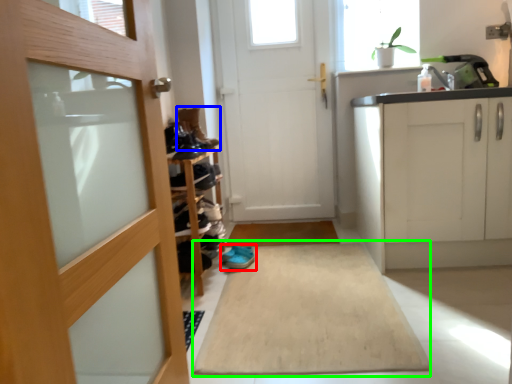
Question: Which object is the farthest from footwear (highlighted by a red box)? Choose among these: shoe (highlighted by a blue box) or bath mat (highlighted by a green box).

Choices:
 (A) shoe
 (B) bath mat

Answer: (A)